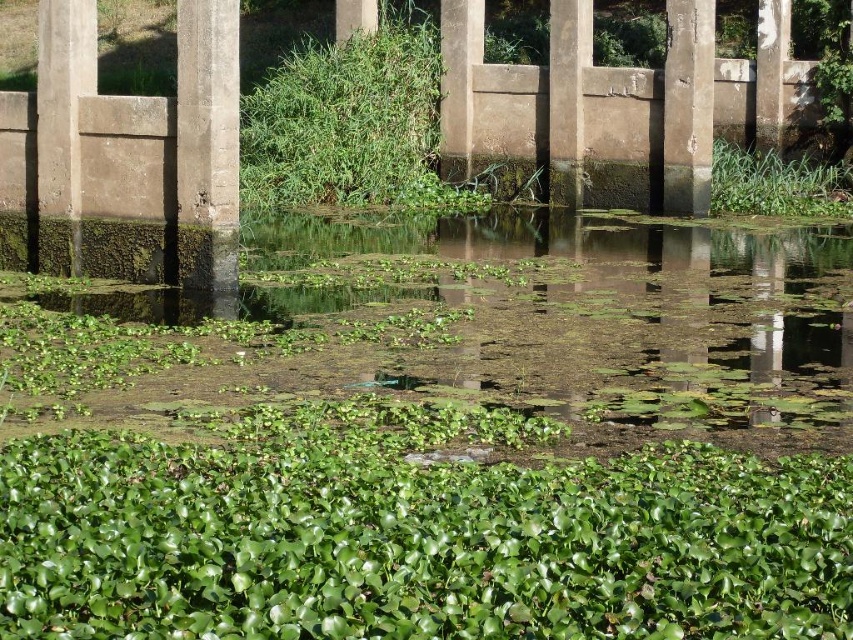
In the scene shown: Between smooth concrete pillar at right and green leafy plant at right, which one is positioned higher?

Positioned higher is smooth concrete pillar at right.

Does smooth concrete pillar at right have a larger size compared to green leafy plant at right?

No, smooth concrete pillar at right is not bigger than green leafy plant at right.

Is point (669, 74) positioned before point (759, 172)?

That is True.

The height and width of the screenshot is (640, 853). In order to click on smooth concrete pillar at right in this screenshot , I will do 688,106.